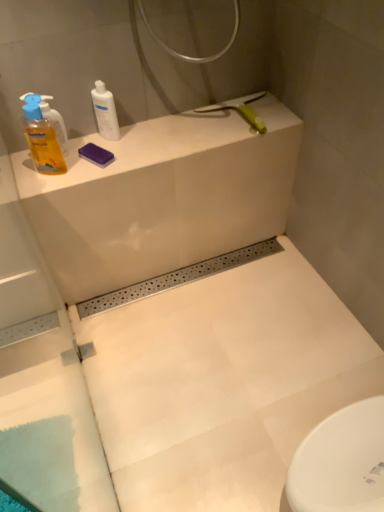
The image size is (384, 512). Identify the location of empty space that is ontop of white matte counter top at upper left. (159, 137).